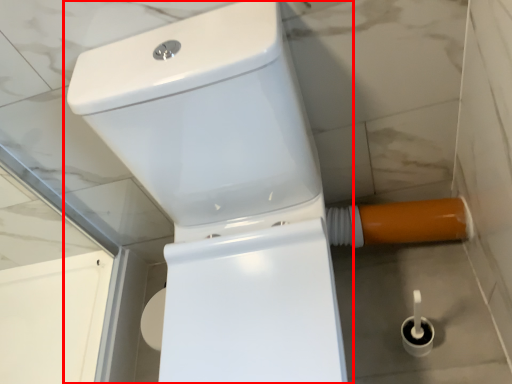
Question: Considering the relative positions of toilet (annotated by the red box) and water pipe in the image provided, where is toilet (annotated by the red box) located with respect to the staircase?

Choices:
 (A) right
 (B) left

Answer: (B)